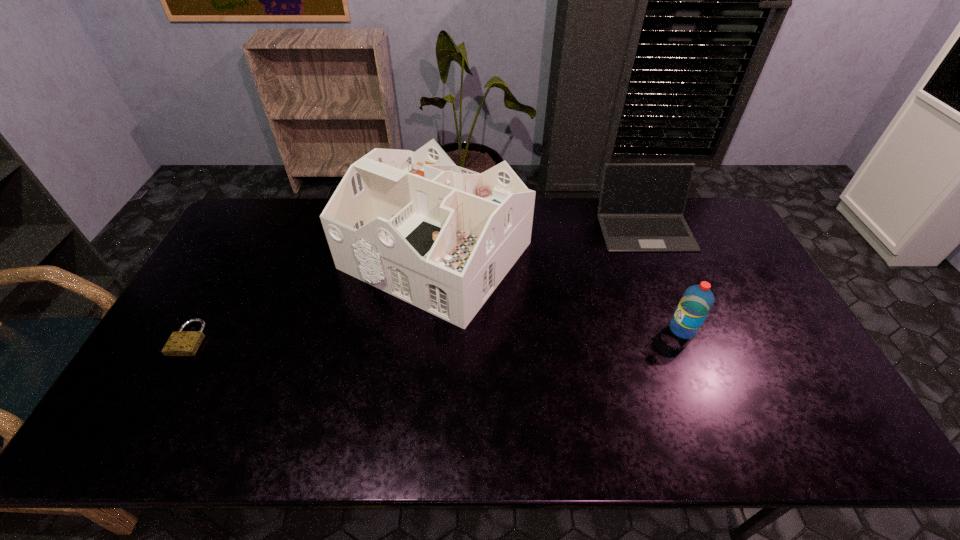
Image resolution: width=960 pixels, height=540 pixels. What are the coordinates of `the second object from left to right` in the screenshot? It's located at (441, 237).

Identify the location of the tallest object. This screenshot has width=960, height=540. (441, 237).

Where is `laptop`? laptop is located at coordinates click(641, 206).

Locate an element on the screen. water bottle is located at coordinates (696, 302).

Locate an element on the screen. The image size is (960, 540). the shortest object is located at coordinates (182, 343).

I want to click on padlock, so click(182, 343).

Where is `blank space located on the front of the tallest object`? blank space located on the front of the tallest object is located at coordinates (420, 394).

You are a GUI agent. You are given a task and a screenshot of the screen. Output one action in this format:
    pyautogui.click(x=<x>, y=<y>)
    Task: Click on the free space located on the screen of the laptop
    
    Given the screenshot: What is the action you would take?
    pyautogui.click(x=669, y=287)

Locate an element on the screen. vacant space located 0.070m on the front label of the water bottle is located at coordinates (644, 329).

Image resolution: width=960 pixels, height=540 pixels. What are the coordinates of `free space located on the front label of the water bottle` in the screenshot? It's located at (556, 329).